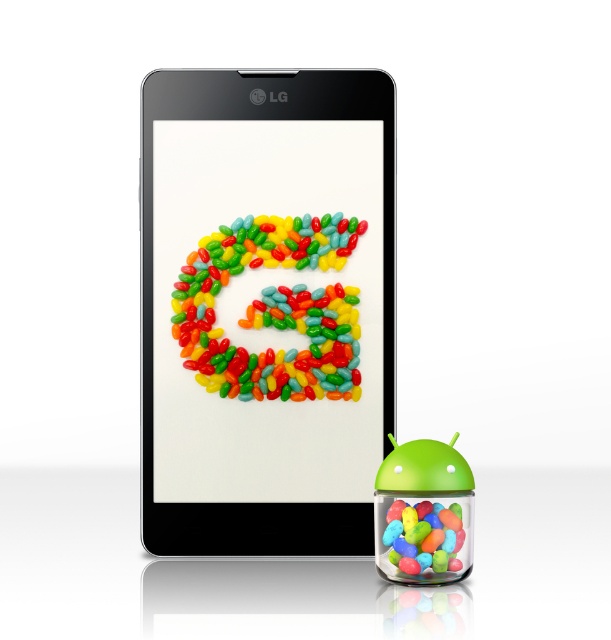
You are holding a matte plastic phone at center and want to place it next to the glossy jellybeans at center. Based on the current arrangement, which direction should you move the phone to align it with the jellybeans?

The matte plastic phone at center is already positioned on the left side of the glossy jellybeans at center. To align it with the jellybeans, you can move it to the right so that it is closer to the glossy jellybeans at center.

You are holding a smartphone case that is 6 inches wide. You want to place it so it covers both the matte plastic phone at center and the glossy plastic jelly beans at lower right. Is this possible?

The matte plastic phone at center and glossy plastic jelly beans at lower right are 5.97 inches apart. Since the case is 6 inches wide, it can cover both objects as the distance between them is slightly less than the case width.

You are trying to place the glossy plastic jelly beans at lower right into the matte plastic phone at center. Will they fit inside the phone?

The matte plastic phone at center is larger in size compared to the glossy plastic jelly beans at lower right, so it is possible that the glossy plastic jelly beans at lower right could fit inside the phone.